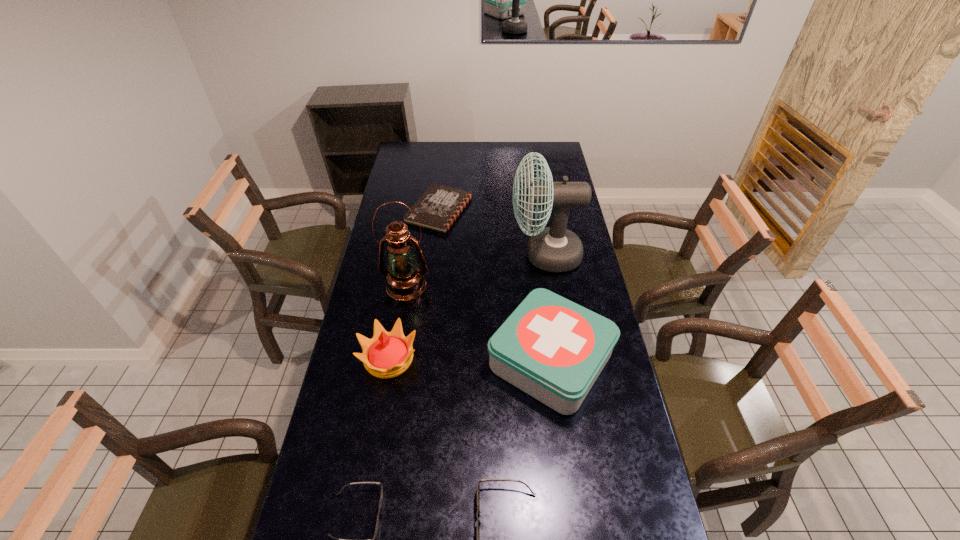
The image size is (960, 540). In order to click on free location located on the left of the oil lamp in this screenshot , I will do `click(367, 286)`.

Where is `vacant space located 0.170m on the front of the crown`? Image resolution: width=960 pixels, height=540 pixels. vacant space located 0.170m on the front of the crown is located at coordinates (375, 435).

In order to click on notebook at the left edge in this screenshot , I will do `click(439, 206)`.

The height and width of the screenshot is (540, 960). In order to click on oil lamp that is at the left edge in this screenshot , I will do `click(405, 281)`.

You are a GUI agent. You are given a task and a screenshot of the screen. Output one action in this format:
    pyautogui.click(x=<x>, y=<y>)
    Task: Click on the crown present at the left edge
    Image resolution: width=960 pixels, height=540 pixels.
    Given the screenshot: What is the action you would take?
    pyautogui.click(x=388, y=354)

You are a GUI agent. You are given a task and a screenshot of the screen. Output one action in this format:
    pyautogui.click(x=<x>, y=<y>)
    Task: Click on the first-aid kit located in the right edge section of the desktop
    
    Given the screenshot: What is the action you would take?
    pyautogui.click(x=553, y=349)

Identify the location of fan positioned at the right edge. (554, 249).

I want to click on vacant area at the far edge of the desktop, so [430, 142].

Image resolution: width=960 pixels, height=540 pixels. I want to click on blank space at the near edge, so click(420, 520).

The height and width of the screenshot is (540, 960). Find the location of `free space at the left edge`. free space at the left edge is located at coordinates (385, 294).